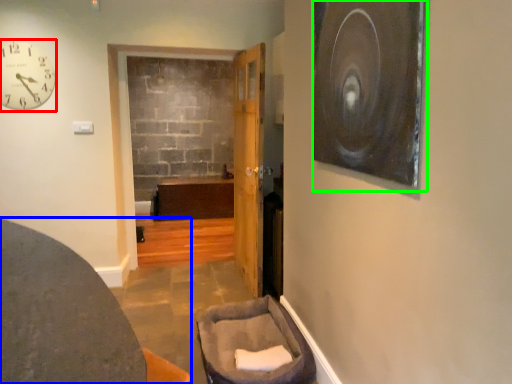
Question: Which is nearer to the clock (highlighted by a red box)? furniture (highlighted by a blue box) or picture frame (highlighted by a green box).

Choices:
 (A) furniture
 (B) picture frame

Answer: (A)